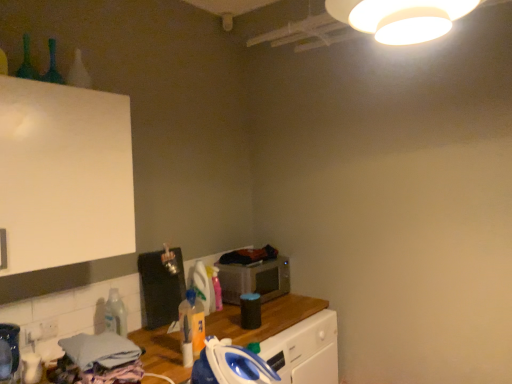
Question: Considering the positions of translucent plastic bottle at center, which is the third bottle in left-to-right order, and clear plastic bottle at lower left, the second bottle positioned from the left, in the image, is translucent plastic bottle at center, which is the third bottle in left-to-right order, bigger or smaller than clear plastic bottle at lower left, the second bottle positioned from the left,?

Choices:
 (A) big
 (B) small

Answer: (B)

Question: Visually, is translucent plastic bottle at center, the 1th bottle in the right-to-left sequence, positioned to the left or to the right of clear plastic bottle at lower left, which is the 1th bottle in back-to-front order?

Choices:
 (A) left
 (B) right

Answer: (B)

Question: Which object is positioned closest to the translucent plastic bottle at center, which appears as the second bottle when viewed from the front?

Choices:
 (A) clear plastic bottle at lower left, which is the 1th bottle in back-to-front order
 (B) blue plastic iron at lower center
 (C) green glass bottle at upper left, which is the third bottle in back-to-front order
 (D) metallic silver microwave at center

Answer: (B)

Question: Based on their relative distances, which object is farther from the translucent plastic bottle at center, acting as the second bottle starting from the bottom?

Choices:
 (A) clear plastic bottle at lower left, which is the first bottle from bottom to top
 (B) blue plastic iron at lower center
 (C) green glass bottle at upper left, which is the first bottle from top to bottom
 (D) metallic silver microwave at center

Answer: (C)